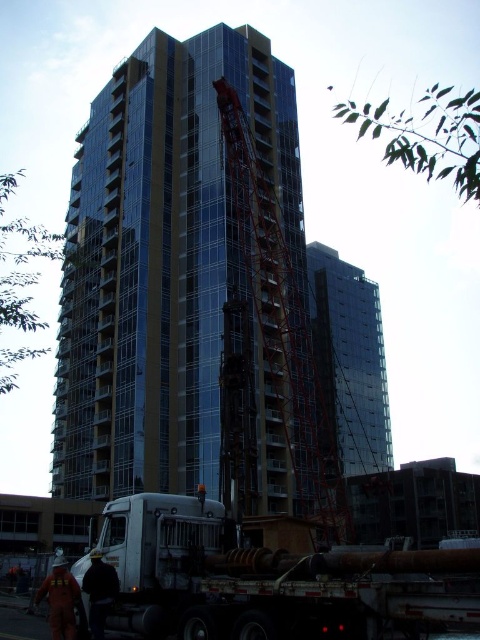
Can you confirm if orange reflective suit at lower left is thinner than dark gray fabric jacket at lower left?

No.

Who is more forward, (64, 632) or (97, 600)?

Positioned in front is point (64, 632).

Describe the element at coordinates (60, 600) in the screenshot. I see `orange reflective suit at lower left` at that location.

Locate an element on the screen. orange reflective suit at lower left is located at coordinates (60, 600).

Is point (283, 636) positioned in front of point (300, 454)?

Yes, point (283, 636) is closer to viewer.

Can you confirm if white matte trailer truck at lower left is shorter than reddish metallic crane at center?

Yes, white matte trailer truck at lower left is shorter than reddish metallic crane at center.

Locate an element on the screen. The width and height of the screenshot is (480, 640). white matte trailer truck at lower left is located at coordinates (271, 580).

Is white matte trailer truck at lower left thinner than orange reflective suit at lower left?

No, white matte trailer truck at lower left is not thinner than orange reflective suit at lower left.

Between white matte trailer truck at lower left and orange reflective suit at lower left, which one has more height?

Standing taller between the two is white matte trailer truck at lower left.

Which is behind, point (118, 566) or point (69, 602)?

The point (118, 566) is behind.

The height and width of the screenshot is (640, 480). What are the coordinates of `white matte trailer truck at lower left` in the screenshot? It's located at (271, 580).